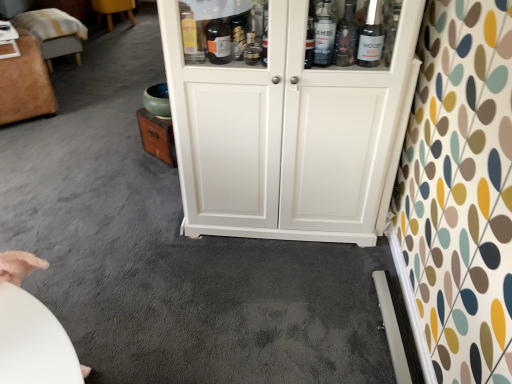
Question: Is velvet ottoman at upper left, which is the second furniture in front-to-back order, spatially inside velvet ottoman at left, marked as the 1th furniture in a front-to-back arrangement, or outside of it?

Choices:
 (A) inside
 (B) outside

Answer: (B)

Question: Considering the relative positions of velvet ottoman at upper left, which is the 2th furniture in back-to-front order, and velvet ottoman at left, which is the third furniture from back to front, in the image provided, is velvet ottoman at upper left, which is the 2th furniture in back-to-front order, to the left or to the right of velvet ottoman at left, which is the third furniture from back to front,?

Choices:
 (A) left
 (B) right

Answer: (B)

Question: Estimate the real-world distances between objects in this image. Which object is closer to the velvet ottoman at upper left, which is the 2th furniture in back-to-front order?

Choices:
 (A) velvet ottoman at left, which is the third furniture from back to front
 (B) white glossy table at upper left
 (C) white wood cupboard at center
 (D) wooden stool at upper left, the third furniture positioned from the front

Answer: (B)

Question: Based on their relative distances, which object is nearer to the velvet ottoman at left, which is the third furniture from back to front?

Choices:
 (A) velvet ottoman at upper left, which is the second furniture in front-to-back order
 (B) white wood cupboard at center
 (C) wooden stool at upper left, which ranks as the first furniture in back-to-front order
 (D) white glossy table at upper left

Answer: (D)